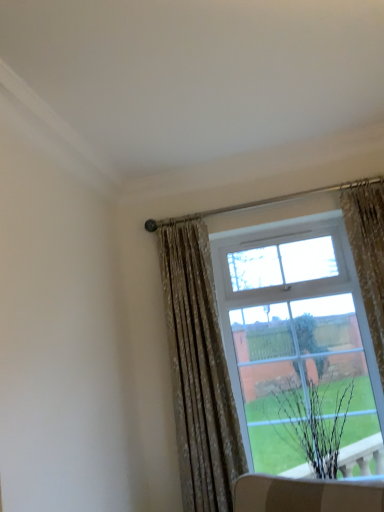
Question: From the image's perspective, would you say floral fabric curtain at right, placed as the second curtain when sorted from left to right, is positioned over black matte plant at lower right?

Choices:
 (A) no
 (B) yes

Answer: (B)

Question: Is floral fabric curtain at right, placed as the second curtain when sorted from left to right, smaller than black matte plant at lower right?

Choices:
 (A) no
 (B) yes

Answer: (B)

Question: Considering the relative positions of floral fabric curtain at right, the 1th curtain in the right-to-left sequence, and black matte plant at lower right in the image provided, is floral fabric curtain at right, the 1th curtain in the right-to-left sequence, to the right of black matte plant at lower right from the viewer's perspective?

Choices:
 (A) no
 (B) yes

Answer: (B)

Question: Is floral fabric curtain at right, placed as the second curtain when sorted from left to right, with black matte plant at lower right?

Choices:
 (A) no
 (B) yes

Answer: (A)

Question: Can you confirm if floral fabric curtain at right, the 1th curtain in the right-to-left sequence, is bigger than black matte plant at lower right?

Choices:
 (A) yes
 (B) no

Answer: (B)

Question: Considering the positions of point (301, 454) and point (198, 223), is point (301, 454) closer or farther from the camera than point (198, 223)?

Choices:
 (A) closer
 (B) farther

Answer: (A)

Question: In terms of height, does black matte plant at lower right look taller or shorter compared to floral fabric curtain at upper right, which is the 2th curtain in right-to-left order?

Choices:
 (A) short
 (B) tall

Answer: (A)

Question: From the image's perspective, is black matte plant at lower right located above or below floral fabric curtain at upper right, marked as the 1th curtain in a left-to-right arrangement?

Choices:
 (A) below
 (B) above

Answer: (A)

Question: Is black matte plant at lower right spatially inside floral fabric curtain at upper right, which is the 2th curtain in right-to-left order, or outside of it?

Choices:
 (A) outside
 (B) inside

Answer: (A)

Question: From a real-world perspective, is floral fabric curtain at upper right, which is the 2th curtain in right-to-left order, above or below floral fabric curtain at right, the 1th curtain in the right-to-left sequence?

Choices:
 (A) below
 (B) above

Answer: (A)

Question: Considering the positions of floral fabric curtain at upper right, which is the 2th curtain in right-to-left order, and floral fabric curtain at right, the 1th curtain in the right-to-left sequence, in the image, is floral fabric curtain at upper right, which is the 2th curtain in right-to-left order, taller or shorter than floral fabric curtain at right, the 1th curtain in the right-to-left sequence,?

Choices:
 (A) tall
 (B) short

Answer: (A)

Question: Considering their positions, is floral fabric curtain at upper right, which is the 2th curtain in right-to-left order, located in front of or behind floral fabric curtain at right, the 1th curtain in the right-to-left sequence?

Choices:
 (A) front
 (B) behind

Answer: (B)

Question: Visually, is floral fabric curtain at upper right, which is the 2th curtain in right-to-left order, positioned to the left or to the right of floral fabric curtain at right, the 1th curtain in the right-to-left sequence?

Choices:
 (A) left
 (B) right

Answer: (A)

Question: From a real-world perspective, relative to black matte plant at lower right, is floral fabric curtain at upper right, which is the 2th curtain in right-to-left order, vertically above or below?

Choices:
 (A) above
 (B) below

Answer: (A)

Question: In terms of width, does floral fabric curtain at upper right, which is the 2th curtain in right-to-left order, look wider or thinner when compared to black matte plant at lower right?

Choices:
 (A) wide
 (B) thin

Answer: (B)